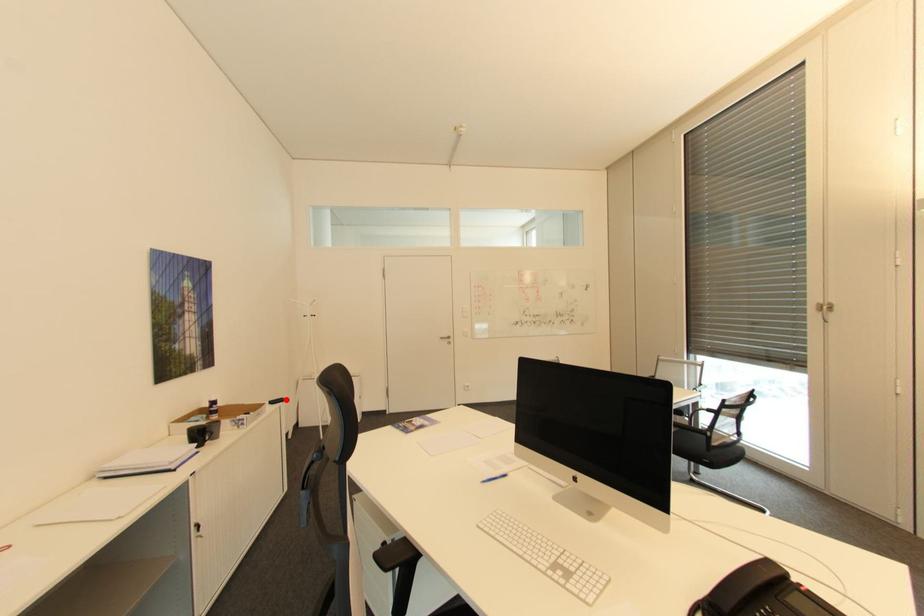
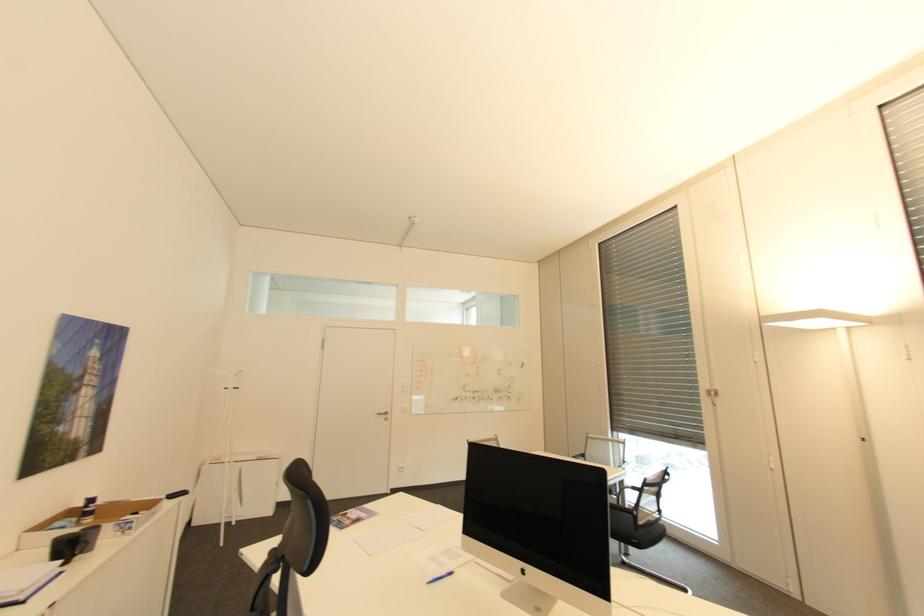
Where in the second image is the point corresponding to the highlighted location from the first image?

(188, 493)